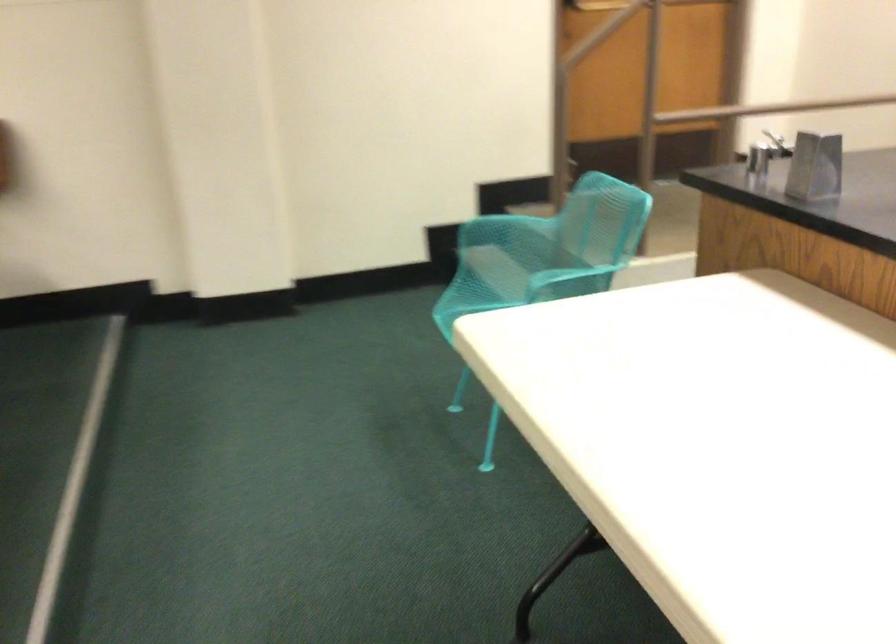
In order to click on turquoise chair armrest in this screenshot , I will do `click(494, 218)`.